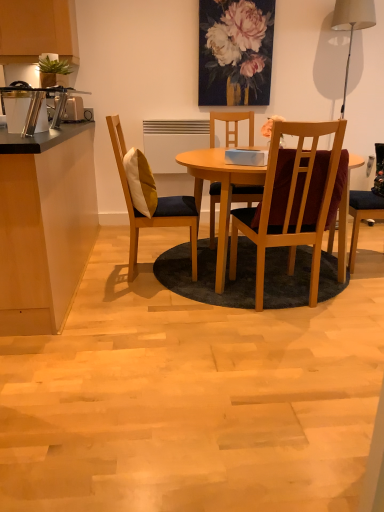
Locate an element on the screen. The width and height of the screenshot is (384, 512). free space in front of wooden chair with cushion at left, the first chair in the left-to-right sequence is located at coordinates point(134,302).